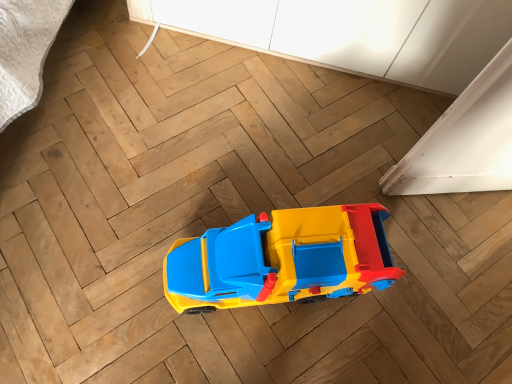
Describe the element at coordinates (281, 259) in the screenshot. This screenshot has height=384, width=512. I see `matte plastic toy car at center` at that location.

Where is `matte plastic toy car at center`? matte plastic toy car at center is located at coordinates 281,259.

Locate an element on the screen. The image size is (512, 384). matte plastic toy car at center is located at coordinates (281, 259).